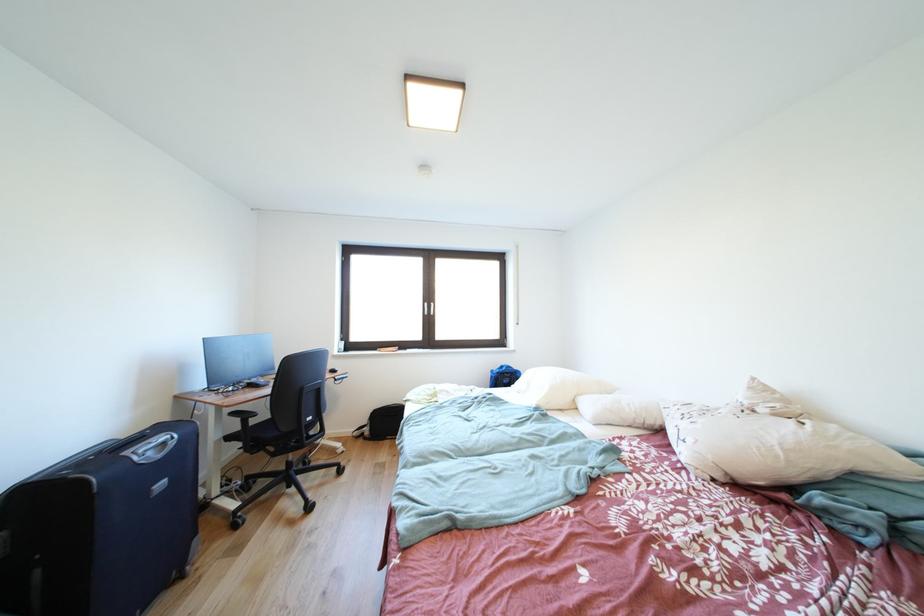
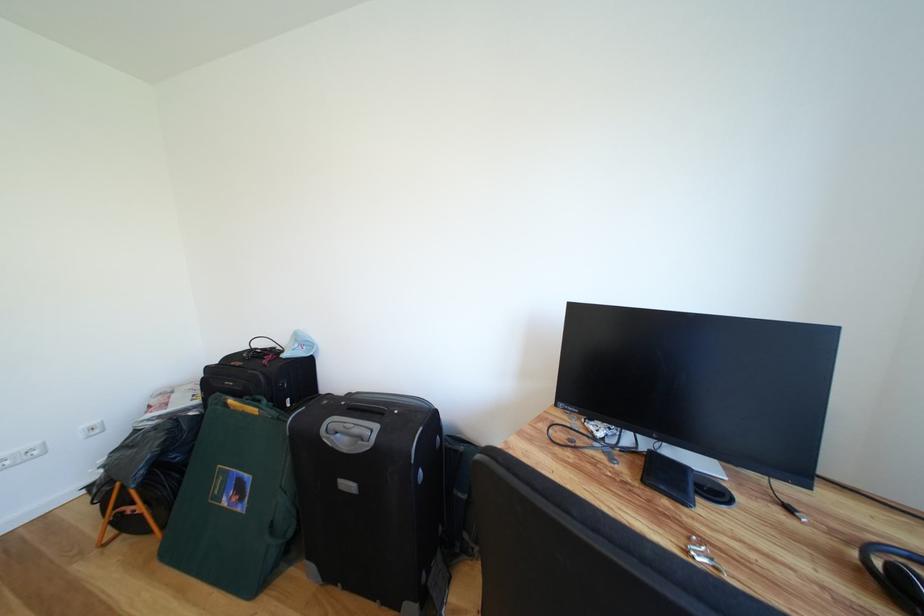
The point at (167, 461) is marked in the first image. Where is the corresponding point in the second image?

(353, 455)